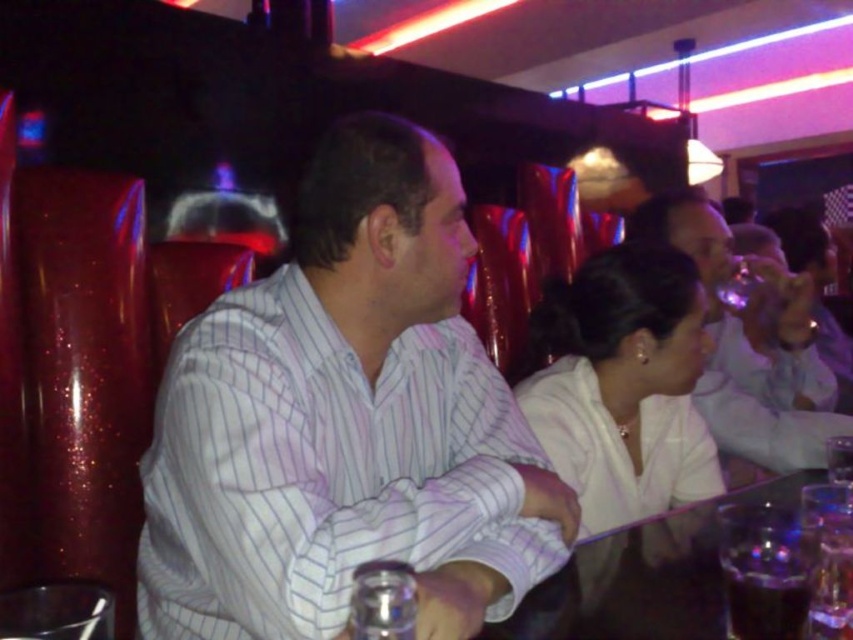
Question: Which object is positioned closest to the translucent glass table at center?

Choices:
 (A) white striped shirt at center
 (B) white satin blouse at center

Answer: (A)

Question: Does white striped shirt at center appear on the right side of white glossy shirt at upper right?

Choices:
 (A) yes
 (B) no

Answer: (B)

Question: Is white striped shirt at center to the left of white glossy shirt at upper right from the viewer's perspective?

Choices:
 (A) no
 (B) yes

Answer: (B)

Question: Which object appears farthest from the camera in this image?

Choices:
 (A) translucent glass table at center
 (B) white glossy shirt at upper right
 (C) dark liquid glass at lower right
 (D) white satin blouse at center

Answer: (B)

Question: Which object is farther from the camera taking this photo?

Choices:
 (A) white striped shirt at center
 (B) dark liquid glass at lower right
 (C) white satin blouse at center
 (D) white glossy shirt at upper right

Answer: (D)

Question: In this image, where is white striped shirt at center located relative to white glossy shirt at upper right?

Choices:
 (A) below
 (B) above

Answer: (A)